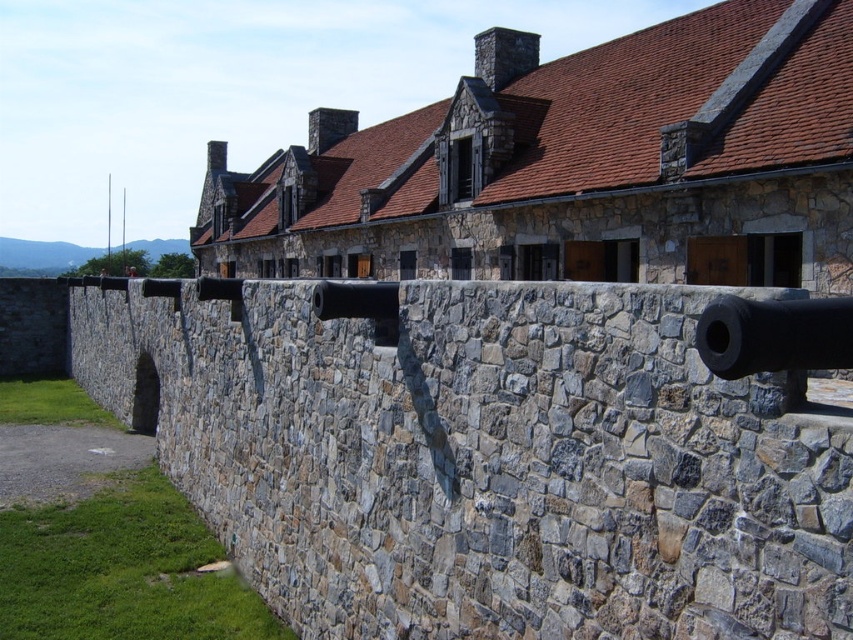
You are a military engineer inspecting the historic fortifications. You notice the gray stone wall at center and the black matte cannon at right. Based on their positions, which object is located higher in elevation?

The black matte cannon at right is positioned higher in elevation than the gray stone wall at center because the gray stone wall at center is under it.

You are a soldier positioned at the stone brick building at center. You need to move to the black matte cannon at right to adjust its aim. Given that your maximum safe movement distance without alerting the enemy is 25 meters, can you reach the cannon without being detected?

The distance between the stone brick building at center and the black matte cannon at right is 27.53 meters, which exceeds your maximum safe movement distance of 25 meters. Therefore, you cannot reach the cannon without potentially being detected.

You are an engineer assessing the structural integrity of the gray stone wall at center and the stone brick building at center. Which structure has a narrower width according to the measurements?

The gray stone wall at center has a narrower width than the stone brick building at center.